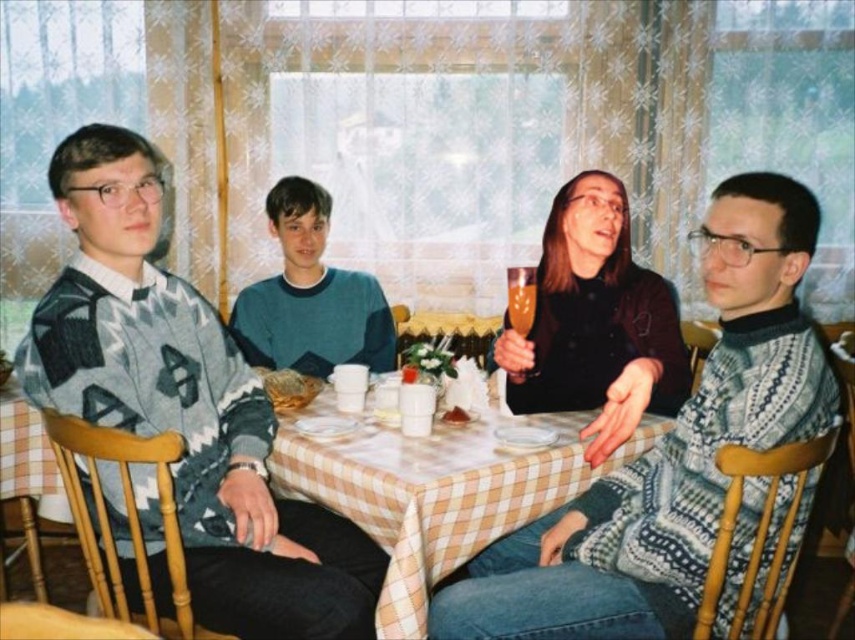
Is teal sweater at center positioned before translucent glass at upper center?

That is False.

Does point (360, 275) come closer to viewer compared to point (522, 330)?

No.

Identify the location of teal sweater at center. (310, 296).

Between knitted sweater at left and translucent glass at center, which one is positioned higher?

knitted sweater at left is above.

Is knitted sweater at left closer to the viewer compared to translucent glass at center?

Yes, knitted sweater at left is in front of translucent glass at center.

Who is more distant from viewer, (208, 339) or (461, 419)?

The point (461, 419) is more distant.

Image resolution: width=855 pixels, height=640 pixels. I want to click on knitted sweater at left, so click(x=186, y=406).

Does knitted sweater at left have a lesser width compared to checkered fabric table at center?

Yes, knitted sweater at left is thinner than checkered fabric table at center.

What do you see at coordinates (186, 406) in the screenshot? I see `knitted sweater at left` at bounding box center [186, 406].

Between point (75, 358) and point (429, 472), which one is positioned in front?

Point (75, 358)

At what (x,y) coordinates should I click in order to perform the action: click on knitted sweater at left. Please return your answer as a coordinate pair (x, y). Looking at the image, I should click on (186, 406).